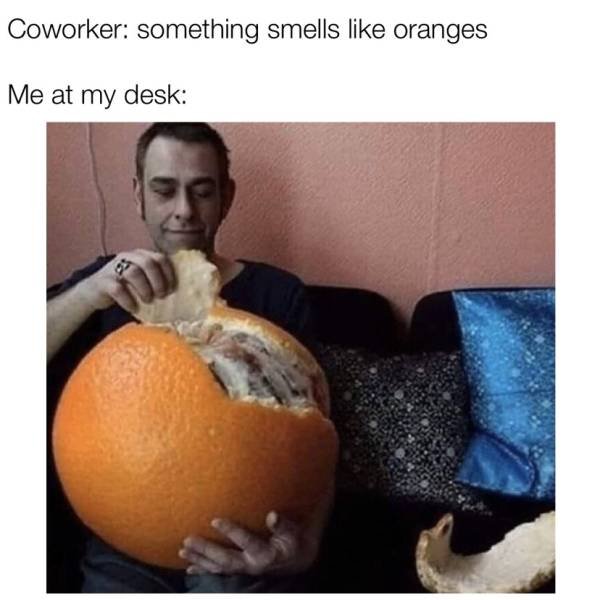
Locate an element on the screen. Image resolution: width=600 pixels, height=600 pixels. floral pattern is located at coordinates (425, 427), (516, 373).